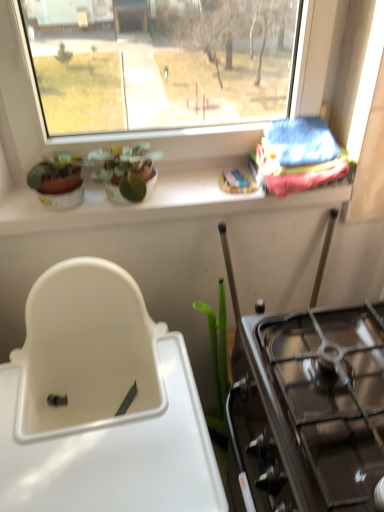
Question: Are black glass gas stove at right and blue fabric at upper right located far from each other?

Choices:
 (A) yes
 (B) no

Answer: (B)

Question: Considering the relative sizes of black glass gas stove at right and blue fabric at upper right in the image provided, is black glass gas stove at right taller than blue fabric at upper right?

Choices:
 (A) no
 (B) yes

Answer: (B)

Question: Does black glass gas stove at right turn towards blue fabric at upper right?

Choices:
 (A) yes
 (B) no

Answer: (B)

Question: Is black glass gas stove at right oriented away from blue fabric at upper right?

Choices:
 (A) yes
 (B) no

Answer: (B)

Question: Is black glass gas stove at right placed right next to blue fabric at upper right?

Choices:
 (A) yes
 (B) no

Answer: (B)

Question: Considering the positions of point (39, 495) and point (115, 170), is point (39, 495) closer or farther from the camera than point (115, 170)?

Choices:
 (A) closer
 (B) farther

Answer: (A)

Question: In terms of width, does white plastic sink at lower left look wider or thinner when compared to matte ceramic plant at upper center?

Choices:
 (A) wide
 (B) thin

Answer: (A)

Question: Is white plastic sink at lower left to the left or to the right of matte ceramic plant at upper center in the image?

Choices:
 (A) left
 (B) right

Answer: (A)

Question: Considering the positions of white plastic sink at lower left and matte ceramic plant at upper center in the image, is white plastic sink at lower left taller or shorter than matte ceramic plant at upper center?

Choices:
 (A) short
 (B) tall

Answer: (B)

Question: Is point (178, 169) closer or farther from the camera than point (296, 353)?

Choices:
 (A) closer
 (B) farther

Answer: (B)

Question: In the image, is white ceramic window sill at upper center positioned in front of or behind black glass gas stove at right?

Choices:
 (A) behind
 (B) front

Answer: (A)

Question: From the image's perspective, is white ceramic window sill at upper center above or below black glass gas stove at right?

Choices:
 (A) below
 (B) above

Answer: (B)

Question: Do you think white ceramic window sill at upper center is within black glass gas stove at right, or outside of it?

Choices:
 (A) outside
 (B) inside

Answer: (A)

Question: From a real-world perspective, is blue fabric at upper right positioned above or below white ceramic window sill at upper center?

Choices:
 (A) above
 (B) below

Answer: (A)

Question: Considering the positions of point pyautogui.click(x=314, y=121) and point pyautogui.click(x=155, y=203), is point pyautogui.click(x=314, y=121) closer or farther from the camera than point pyautogui.click(x=155, y=203)?

Choices:
 (A) farther
 (B) closer

Answer: (A)